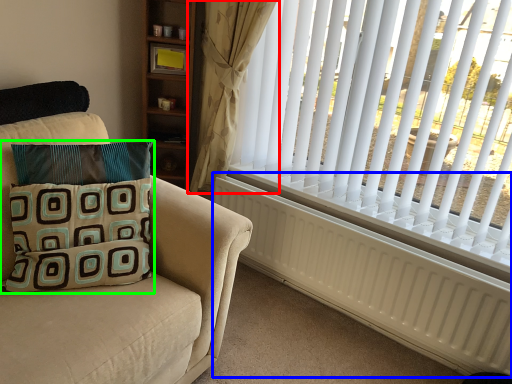
Question: Which object is the closest to the curtain (highlighted by a red box)? Choose among these: radiator (highlighted by a blue box) or pillow (highlighted by a green box).

Choices:
 (A) radiator
 (B) pillow

Answer: (A)